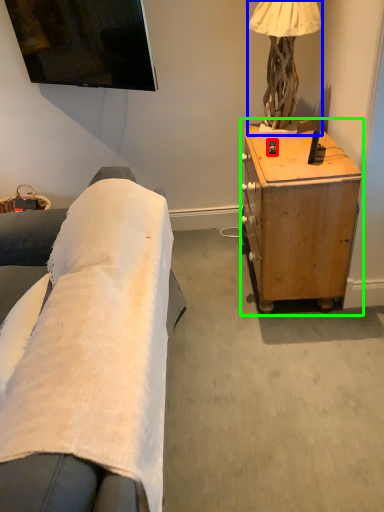
Question: Which object is the closest to the remote control (highlighted by a red box)? Choose among these: lamp (highlighted by a blue box) or desk (highlighted by a green box).

Choices:
 (A) lamp
 (B) desk

Answer: (A)